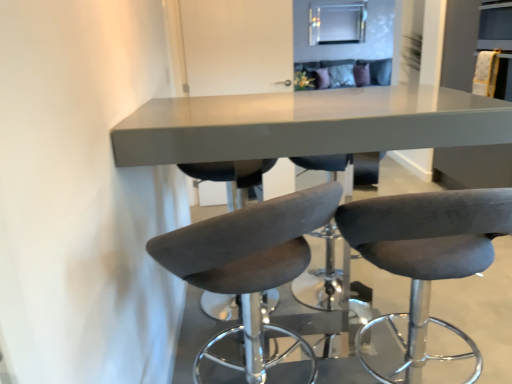
Question: Is matte gray table at center at the back of suede-like gray bar stool at center, which ranks as the 2th chair in right-to-left order?

Choices:
 (A) yes
 (B) no

Answer: (B)

Question: Does suede-like gray bar stool at center, the 1th chair when ordered from left to right, have a lesser height compared to matte gray table at center?

Choices:
 (A) no
 (B) yes

Answer: (B)

Question: Considering the relative sizes of suede-like gray bar stool at center, which ranks as the 2th chair in right-to-left order, and matte gray table at center in the image provided, is suede-like gray bar stool at center, which ranks as the 2th chair in right-to-left order, wider than matte gray table at center?

Choices:
 (A) no
 (B) yes

Answer: (A)

Question: Is suede-like gray bar stool at center, which ranks as the 2th chair in right-to-left order, oriented towards matte gray table at center?

Choices:
 (A) no
 (B) yes

Answer: (B)

Question: Considering the relative positions of suede-like gray bar stool at center, which ranks as the 2th chair in right-to-left order, and matte gray table at center in the image provided, is suede-like gray bar stool at center, which ranks as the 2th chair in right-to-left order, to the right of matte gray table at center from the viewer's perspective?

Choices:
 (A) yes
 (B) no

Answer: (B)

Question: Which is correct: dark gray fabric stool at center, arranged as the first chair when viewed from the right, is inside matte gray table at center, or outside of it?

Choices:
 (A) inside
 (B) outside

Answer: (A)

Question: Is dark gray fabric stool at center, the 2th chair viewed from the left, taller or shorter than matte gray table at center?

Choices:
 (A) short
 (B) tall

Answer: (A)

Question: From the image's perspective, is dark gray fabric stool at center, the 2th chair viewed from the left, located above or below matte gray table at center?

Choices:
 (A) above
 (B) below

Answer: (B)

Question: Considering the positions of dark gray fabric stool at center, arranged as the first chair when viewed from the right, and matte gray table at center in the image, is dark gray fabric stool at center, arranged as the first chair when viewed from the right, wider or thinner than matte gray table at center?

Choices:
 (A) thin
 (B) wide

Answer: (A)

Question: Relative to matte gray table at center, is suede-like gray bar stool at center, the 1th chair when ordered from left to right, in front or behind?

Choices:
 (A) front
 (B) behind

Answer: (A)

Question: In terms of width, does suede-like gray bar stool at center, the 1th chair when ordered from left to right, look wider or thinner when compared to matte gray table at center?

Choices:
 (A) wide
 (B) thin

Answer: (B)

Question: From a real-world perspective, is suede-like gray bar stool at center, the 1th chair when ordered from left to right, positioned above or below matte gray table at center?

Choices:
 (A) above
 (B) below

Answer: (B)

Question: In the image, is suede-like gray bar stool at center, which ranks as the 2th chair in right-to-left order, on the left side or the right side of matte gray table at center?

Choices:
 (A) left
 (B) right

Answer: (A)

Question: Considering the positions of point [480, 251] and point [289, 256], is point [480, 251] closer or farther from the camera than point [289, 256]?

Choices:
 (A) farther
 (B) closer

Answer: (B)

Question: Is dark gray fabric stool at center, the 2th chair viewed from the left, in front of or behind suede-like gray bar stool at center, the 1th chair when ordered from left to right, in the image?

Choices:
 (A) behind
 (B) front

Answer: (A)